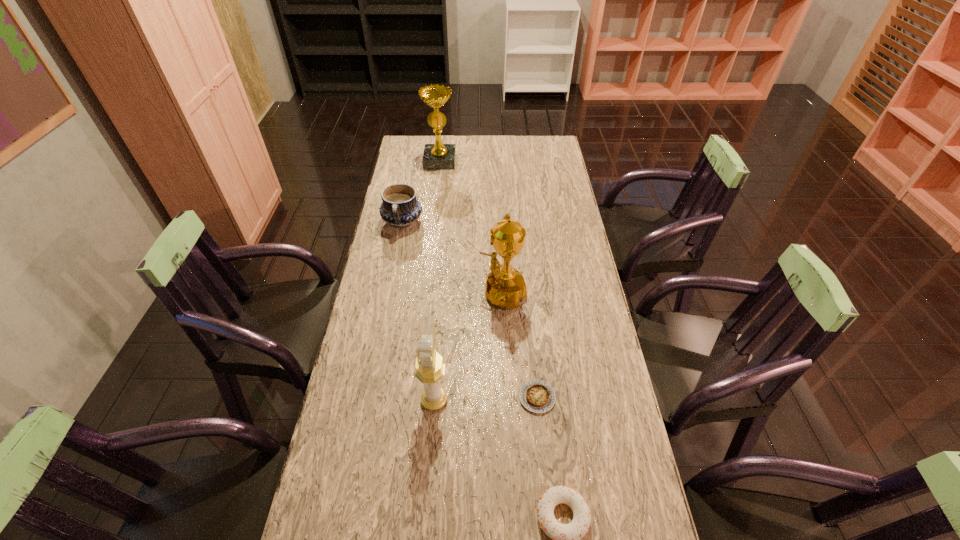
In order to click on vacant region located 0.130m on the front side of the rightmost award in this screenshot , I will do `click(429, 292)`.

The width and height of the screenshot is (960, 540). In order to click on vacant region located 0.320m on the front-facing side of the nearest award in this screenshot , I will do `click(564, 400)`.

I want to click on vacant area situated on the back of the fifth nearest object, so 407,199.

This screenshot has width=960, height=540. I want to click on free space located 0.360m on the left of the shortest object, so click(x=389, y=397).

At what (x,y) coordinates should I click in order to perform the action: click on object that is positioned at the far edge. Please return your answer as a coordinate pair (x, y). Looking at the image, I should click on (436, 156).

Image resolution: width=960 pixels, height=540 pixels. Find the location of `award that is positioned at the left edge`. award that is positioned at the left edge is located at coordinates point(436,156).

Where is `pottery at the left edge`? pottery at the left edge is located at coordinates (400, 208).

Locate an element on the screen. The height and width of the screenshot is (540, 960). object located at the far left corner is located at coordinates (436, 156).

Image resolution: width=960 pixels, height=540 pixels. In order to click on free point at the left edge in this screenshot , I will do `click(344, 401)`.

Locate an element on the screen. The image size is (960, 540). free region at the right edge of the desktop is located at coordinates (576, 330).